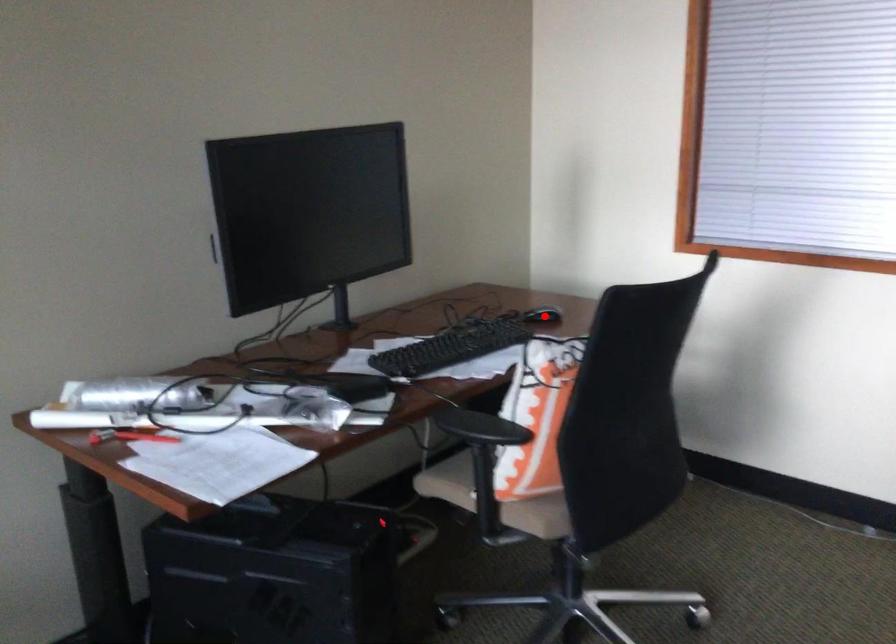
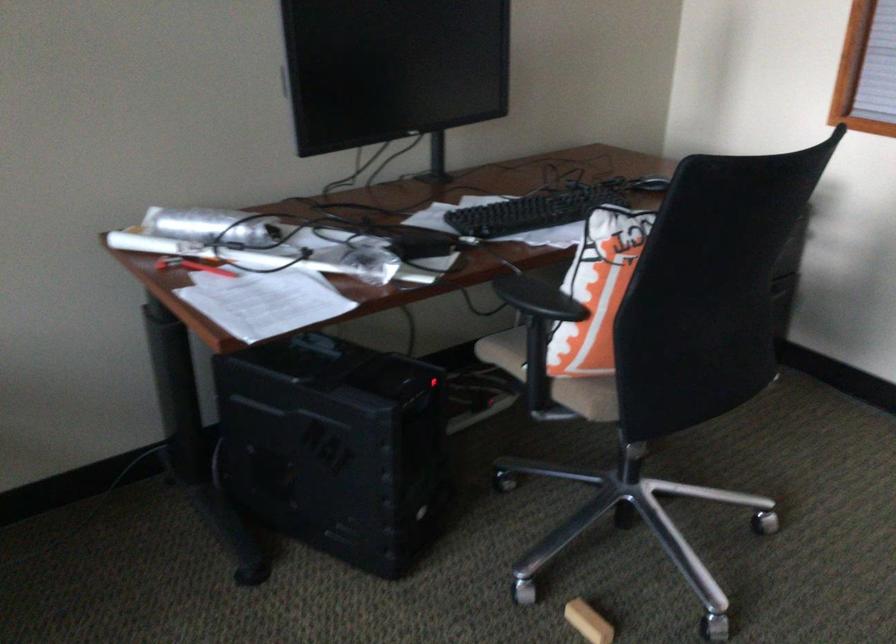
Locate, in the second image, the point that corresponds to the highlighted location in the first image.

(648, 185)